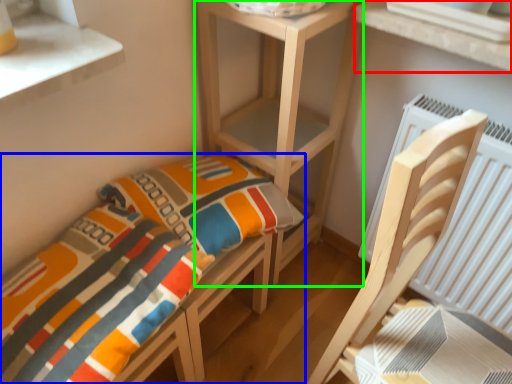
Question: Based on their relative distances, which object is nearer to window (highlighted by a red box)? Choose from furniture (highlighted by a blue box) and shelf (highlighted by a green box).

Choices:
 (A) furniture
 (B) shelf

Answer: (B)